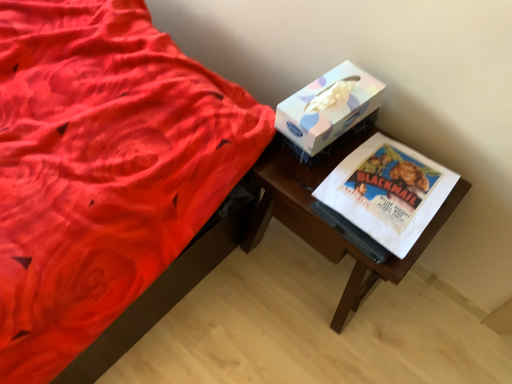
Question: From the image's perspective, is white paper at right located above or below pastel paper tissue box at upper right?

Choices:
 (A) below
 (B) above

Answer: (A)

Question: Visually, is white paper at right positioned to the left or to the right of pastel paper tissue box at upper right?

Choices:
 (A) left
 (B) right

Answer: (B)

Question: Considering the real-world distances, which object is closest to the wooden table at right?

Choices:
 (A) white paper at right
 (B) pastel paper tissue box at upper right

Answer: (A)

Question: Considering the real-world distances, which object is closest to the pastel paper tissue box at upper right?

Choices:
 (A) white paper at right
 (B) wooden table at right

Answer: (A)